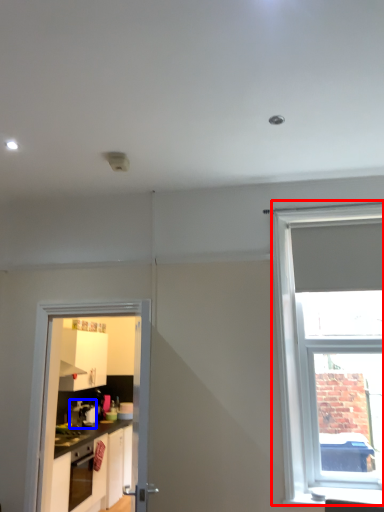
Question: Which object appears closest to the camera in this image, window (highlighted by a red box) or coffee machine (highlighted by a blue box)?

Choices:
 (A) window
 (B) coffee machine

Answer: (A)